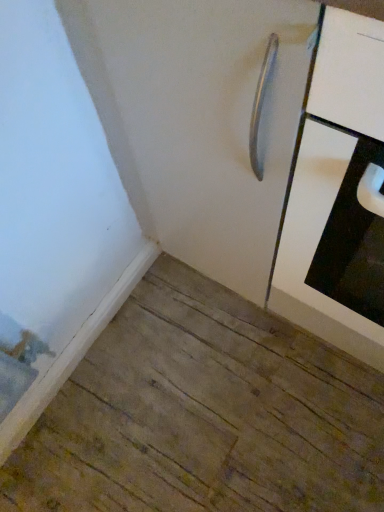
Question: Can you confirm if white matte door at center is wider than white glossy cabinet at upper right?

Choices:
 (A) yes
 (B) no

Answer: (B)

Question: Is white matte door at center facing away from white glossy cabinet at upper right?

Choices:
 (A) no
 (B) yes

Answer: (A)

Question: Considering the relative positions of white matte door at center and white glossy cabinet at upper right in the image provided, is white matte door at center in front of white glossy cabinet at upper right?

Choices:
 (A) no
 (B) yes

Answer: (A)

Question: Considering the relative positions of white matte door at center and white glossy cabinet at upper right in the image provided, is white matte door at center to the right of white glossy cabinet at upper right from the viewer's perspective?

Choices:
 (A) no
 (B) yes

Answer: (A)

Question: From a real-world perspective, is white matte door at center physically above white glossy cabinet at upper right?

Choices:
 (A) no
 (B) yes

Answer: (A)

Question: From the image's perspective, is white matte door at center on white glossy cabinet at upper right?

Choices:
 (A) yes
 (B) no

Answer: (A)

Question: From a real-world perspective, does white glossy cabinet at upper right stand above white matte door at center?

Choices:
 (A) yes
 (B) no

Answer: (A)

Question: Considering the relative positions of white glossy cabinet at upper right and white matte door at center in the image provided, is white glossy cabinet at upper right to the left of white matte door at center from the viewer's perspective?

Choices:
 (A) no
 (B) yes

Answer: (A)

Question: Is white glossy cabinet at upper right smaller than white matte door at center?

Choices:
 (A) yes
 (B) no

Answer: (A)

Question: Considering the relative sizes of white glossy cabinet at upper right and white matte door at center in the image provided, is white glossy cabinet at upper right bigger than white matte door at center?

Choices:
 (A) yes
 (B) no

Answer: (B)

Question: From a real-world perspective, is white glossy cabinet at upper right located beneath white matte door at center?

Choices:
 (A) no
 (B) yes

Answer: (A)

Question: Is white glossy cabinet at upper right positioned with its back to white matte door at center?

Choices:
 (A) yes
 (B) no

Answer: (B)

Question: Considering the positions of white matte door at center and white glossy cabinet at upper right in the image, is white matte door at center wider or thinner than white glossy cabinet at upper right?

Choices:
 (A) thin
 (B) wide

Answer: (A)